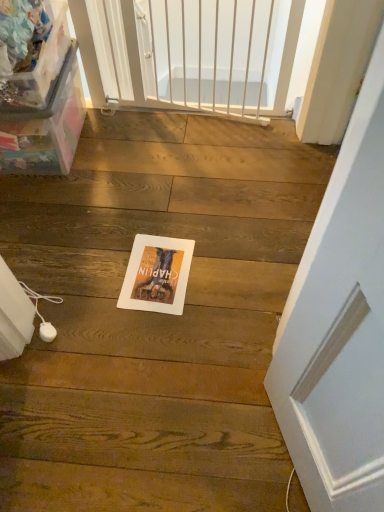
This screenshot has width=384, height=512. I want to click on white metal gate at upper center, so click(x=197, y=53).

The width and height of the screenshot is (384, 512). In order to click on transparent plastic box at left in this screenshot , I will do `click(45, 128)`.

I want to click on box that appears on the left of white metal gate at upper center, so click(x=45, y=128).

Does transparent plastic box at left lie behind white metal gate at upper center?

No, transparent plastic box at left is in front of white metal gate at upper center.

Is point (19, 136) positioned behind point (97, 105)?

No, (19, 136) is in front of (97, 105).

Consider the image. Is transparent plastic box at left positioned far away from white metal gate at upper center?

They are positioned close to each other.

From a real-world perspective, does transparent plastic box at left sit lower than matte paper postcard at center?

No, from a real-world perspective, transparent plastic box at left is not under matte paper postcard at center.

From the image's perspective, would you say transparent plastic box at left is positioned over matte paper postcard at center?

Yes, from the image's perspective, transparent plastic box at left is above matte paper postcard at center.

Who is taller, transparent plastic box at left or matte paper postcard at center?

transparent plastic box at left is taller.

Where is `box above the matte paper postcard at center (from the image's perspective)`? The width and height of the screenshot is (384, 512). box above the matte paper postcard at center (from the image's perspective) is located at coordinates pos(45,128).

Would you say matte paper postcard at center is outside transparent plastic box at left?

Yes, matte paper postcard at center is located beyond the bounds of transparent plastic box at left.

From the image's perspective, does matte paper postcard at center appear higher than transparent plastic box at left?

No, from the image's perspective, matte paper postcard at center is not on top of transparent plastic box at left.

Based on the photo, how many degrees apart are the facing directions of matte paper postcard at center and transparent plastic box at left?

The facing directions of matte paper postcard at center and transparent plastic box at left are 178 degrees apart.

Considering the relative sizes of white metal gate at upper center and transparent plastic box at left in the image provided, is white metal gate at upper center bigger than transparent plastic box at left?

Incorrect, white metal gate at upper center is not larger than transparent plastic box at left.

Is white metal gate at upper center surrounding transparent plastic box at left?

No, transparent plastic box at left is not inside white metal gate at upper center.

From the picture: From a real-world perspective, is white metal gate at upper center physically located above or below transparent plastic box at left?

From a real-world perspective, white metal gate at upper center is physically below transparent plastic box at left.

Relative to matte paper postcard at center, is white metal gate at upper center in front or behind?

white metal gate at upper center is positioned farther from the viewer than matte paper postcard at center.

How distant is white metal gate at upper center from matte paper postcard at center?

The distance of white metal gate at upper center from matte paper postcard at center is 34.06 inches.

Considering the relative sizes of white metal gate at upper center and matte paper postcard at center in the image provided, is white metal gate at upper center thinner than matte paper postcard at center?

Indeed, white metal gate at upper center has a lesser width compared to matte paper postcard at center.

How different are the orientations of white metal gate at upper center and matte paper postcard at center in degrees?

179 degrees.

From the image's perspective, is matte paper postcard at center above white metal gate at upper center?

No.

Measure the distance from matte paper postcard at center to white metal gate at upper center.

The distance of matte paper postcard at center from white metal gate at upper center is 34.06 inches.

Is matte paper postcard at center bigger or smaller than white metal gate at upper center?

In the image, matte paper postcard at center appears to be smaller than white metal gate at upper center.

In the scene shown: From a real-world perspective, is matte paper postcard at center beneath white metal gate at upper center?

Correct, in the physical world, matte paper postcard at center is lower than white metal gate at upper center.

Find the location of a particular element. This screenshot has width=384, height=512. box positioned vertically above the white metal gate at upper center (from a real-world perspective) is located at coordinates (45, 128).

Locate an element on the screen. This screenshot has height=512, width=384. postcard that appears on the right of transparent plastic box at left is located at coordinates (157, 274).

In the scene shown: Considering their positions, is white metal gate at upper center positioned further to transparent plastic box at left than matte paper postcard at center?

matte paper postcard at center.

Looking at the image, which one is located further to matte paper postcard at center, transparent plastic box at left or white metal gate at upper center?

white metal gate at upper center lies further to matte paper postcard at center than the other object.

From the image, which object appears to be nearer to transparent plastic box at left, matte paper postcard at center or white metal gate at upper center?

The object closer to transparent plastic box at left is white metal gate at upper center.

Which object lies nearer to the anchor point matte paper postcard at center, white metal gate at upper center or transparent plastic box at left?

Among the two, transparent plastic box at left is located nearer to matte paper postcard at center.

Which object lies further to the anchor point white metal gate at upper center, matte paper postcard at center or transparent plastic box at left?

Based on the image, matte paper postcard at center appears to be further to white metal gate at upper center.

When comparing their distances from white metal gate at upper center, does transparent plastic box at left or matte paper postcard at center seem closer?

Based on the image, transparent plastic box at left appears to be nearer to white metal gate at upper center.

At what (x,y) coordinates should I click in order to perform the action: click on box between white metal gate at upper center and matte paper postcard at center from top to bottom. Please return your answer as a coordinate pair (x, y). Looking at the image, I should click on click(45, 128).